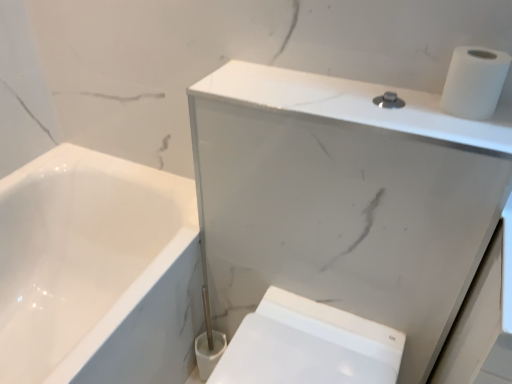
Find the location of `empty space that is ontop of white marble cabinet at upper right (from a real-world perspective)`. empty space that is ontop of white marble cabinet at upper right (from a real-world perspective) is located at coordinates (338, 95).